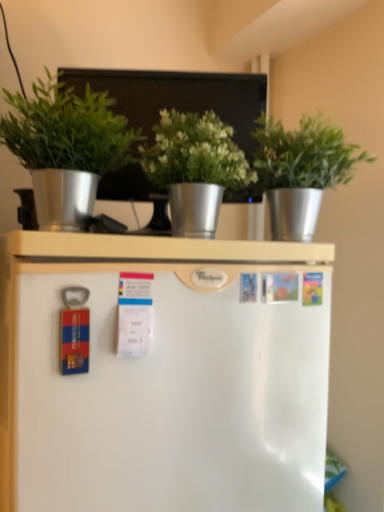
Question: From the image's perspective, is green matte plant at upper left, the 3th houseplant when ordered from right to left, above or below green metallic pot at center, which is the 2th houseplant from right to left?

Choices:
 (A) below
 (B) above

Answer: (B)

Question: Is point (114, 147) closer or farther from the camera than point (183, 154)?

Choices:
 (A) closer
 (B) farther

Answer: (A)

Question: Based on their relative distances, which object is farther from the green metallic pot at center, placed as the second houseplant when sorted from left to right?

Choices:
 (A) green matte plant at upper left, the 3th houseplant when ordered from right to left
 (B) metallic silver bulletin board at upper center
 (C) metallic silver pot at upper center, which is the 1th houseplant in right-to-left order

Answer: (B)

Question: Which of these objects is positioned farthest from the green metallic pot at center, placed as the second houseplant when sorted from left to right?

Choices:
 (A) metallic silver bulletin board at upper center
 (B) green matte plant at upper left, the 3th houseplant when ordered from right to left
 (C) metallic silver pot at upper center, which is the 3th houseplant from left to right

Answer: (A)